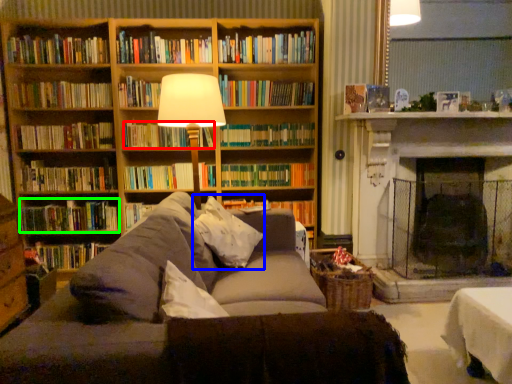
Question: Considering the real-world distances, which object is farthest from book (highlighted by a red box)? pillow (highlighted by a blue box) or book (highlighted by a green box)?

Choices:
 (A) pillow
 (B) book

Answer: (A)